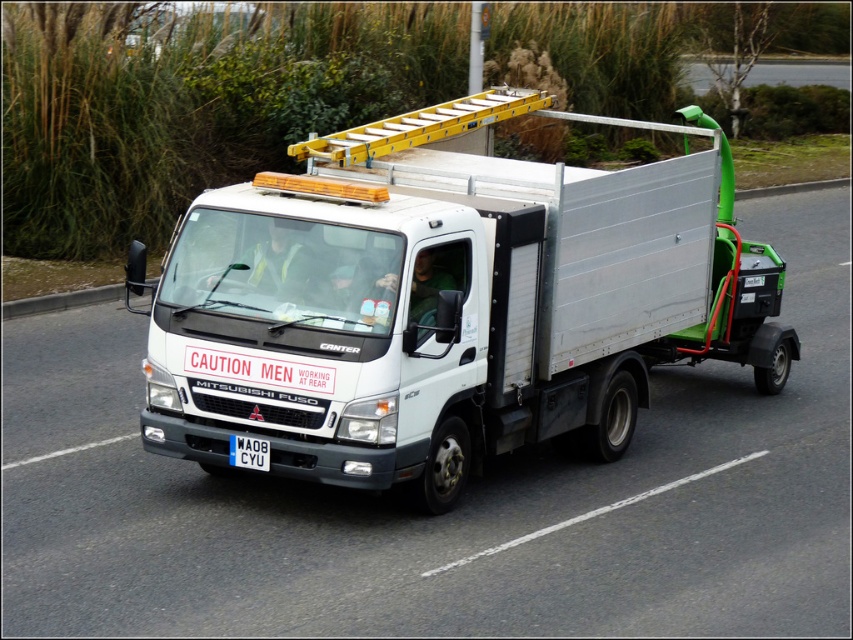
Question: Which point is closer to the camera?

Choices:
 (A) blue plastic license plate at center
 (B) white metallic truck at center
 (C) yellow metallic ladder at upper center

Answer: (A)

Question: Estimate the real-world distances between objects in this image. Which object is farther from the yellow metallic ladder at upper center?

Choices:
 (A) blue plastic license plate at center
 (B) white metallic truck at center

Answer: (B)

Question: Does white metallic truck at center have a smaller size compared to blue plastic license plate at center?

Choices:
 (A) no
 (B) yes

Answer: (A)

Question: Does yellow metallic ladder at upper center appear over blue plastic license plate at center?

Choices:
 (A) no
 (B) yes

Answer: (B)

Question: Based on their relative distances, which object is farther from the white metallic truck at center?

Choices:
 (A) yellow metallic ladder at upper center
 (B) blue plastic license plate at center

Answer: (A)

Question: Does yellow metallic ladder at upper center appear under blue plastic license plate at center?

Choices:
 (A) no
 (B) yes

Answer: (A)